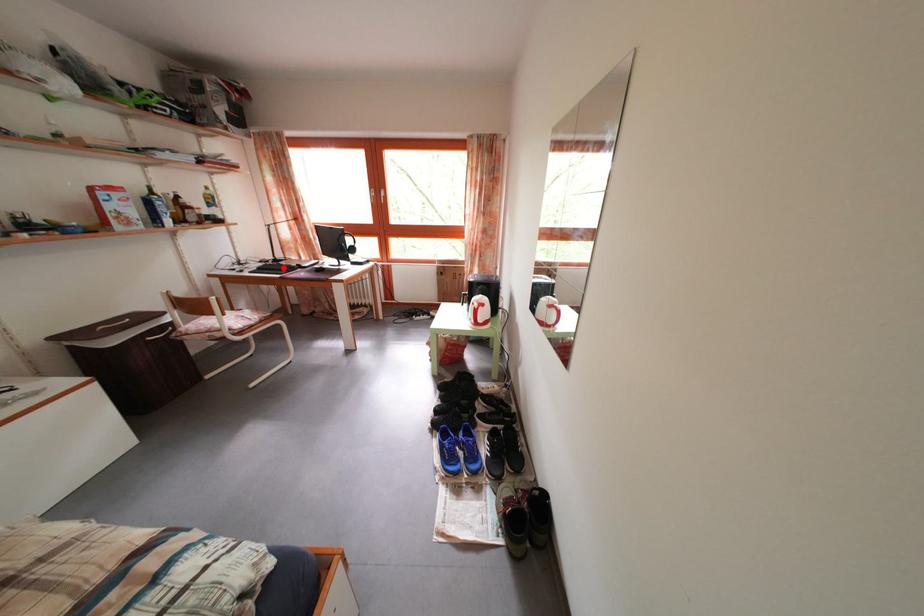
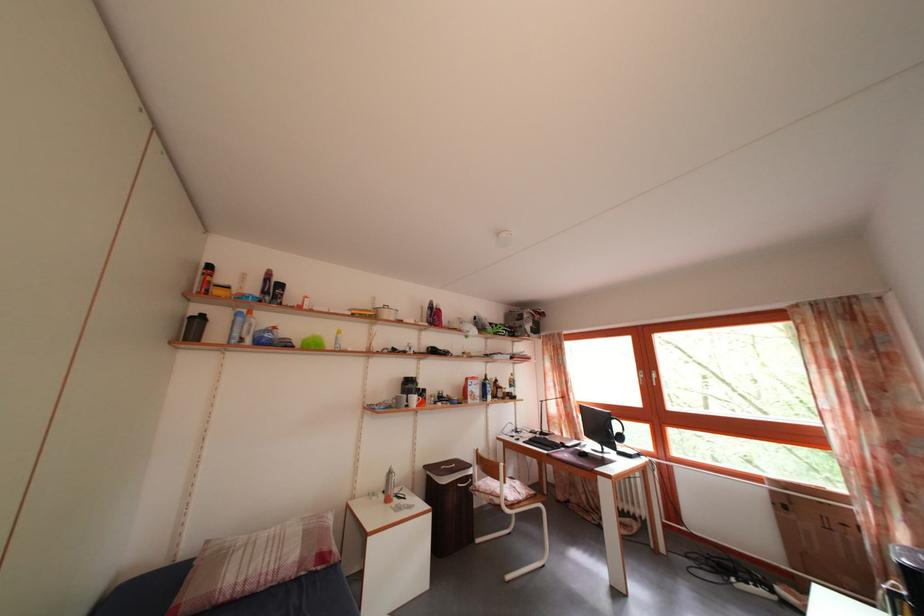
Locate, in the second image, the point that corresponds to the highlighted location in the first image.

(550, 440)